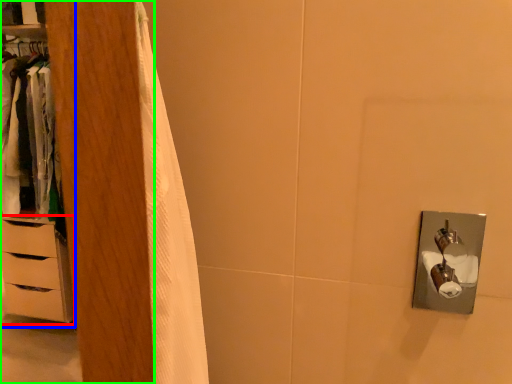
Question: Estimate the real-world distances between objects in this image. Which object is closer to chest of drawers (highlighted by a red box), dresser (highlighted by a blue box) or armoire (highlighted by a green box)?

Choices:
 (A) dresser
 (B) armoire

Answer: (A)